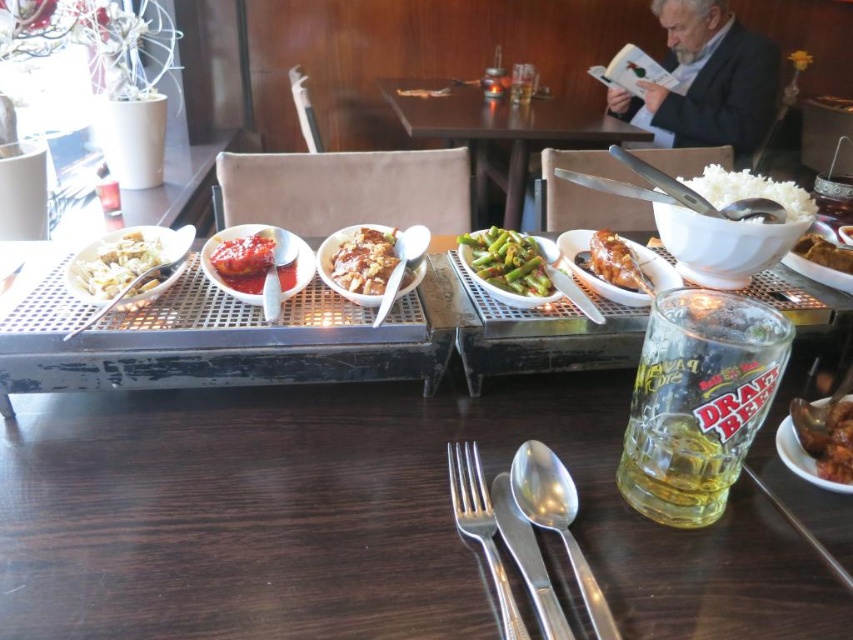
Is point (412, 104) closer to camera compared to point (521, 509)?

No, (412, 104) is further to viewer.

What do you see at coordinates (497, 132) in the screenshot?
I see `wooden table at center` at bounding box center [497, 132].

This screenshot has width=853, height=640. Find the location of `wooden table at center`. wooden table at center is located at coordinates [497, 132].

What do you see at coordinates (480, 525) in the screenshot? I see `satin silver fork at lower center` at bounding box center [480, 525].

Does satin silver fork at lower center have a lesser width compared to clear glass beer at center?

Yes, satin silver fork at lower center is thinner than clear glass beer at center.

Is point (479, 499) farther from camera compared to point (509, 97)?

No, it is in front of (509, 97).

Locate an element on the screen. satin silver fork at lower center is located at coordinates (480, 525).

Who is more distant from viewer, (505, 620) or (532, 566)?

The point (532, 566) is more distant.

Where is `satin silver fork at lower center`? satin silver fork at lower center is located at coordinates (480, 525).

Is point (448, 452) behind point (555, 628)?

Yes, it is behind point (555, 628).

Where is `satin silver fork at lower center`? This screenshot has width=853, height=640. satin silver fork at lower center is located at coordinates (480, 525).